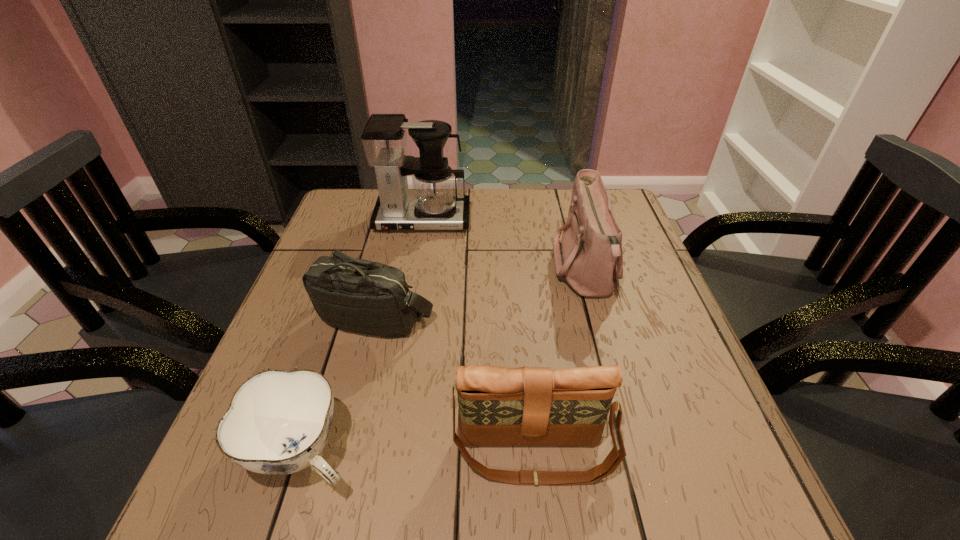
At what (x,y) coordinates should I click in order to perform the action: click on chinaware situated at the near edge. Please return your answer as a coordinate pair (x, y). Looking at the image, I should click on (278, 422).

Find the location of a particular element. The width and height of the screenshot is (960, 540). coffee maker that is at the left edge is located at coordinates (434, 205).

This screenshot has width=960, height=540. Find the location of `shoulder bag at the left edge`. shoulder bag at the left edge is located at coordinates 357,295.

Identify the location of chinaware situated at the left edge. The height and width of the screenshot is (540, 960). [x=278, y=422].

Where is `object at the right edge`? This screenshot has width=960, height=540. object at the right edge is located at coordinates (589, 258).

This screenshot has width=960, height=540. I want to click on object present at the far left corner, so click(x=434, y=205).

Locate an element on the screen. object present at the near left corner is located at coordinates (278, 422).

You are a GUI agent. You are given a task and a screenshot of the screen. Output one action in this format:
    pyautogui.click(x=<x>, y=<y>)
    Task: Click on the vacant space at the far edge of the desktop
    
    Given the screenshot: What is the action you would take?
    pyautogui.click(x=488, y=202)

In the image, there is a desktop. At what (x,y) coordinates should I click in order to perform the action: click on vacant space at the near edge. Please return your answer as a coordinate pair (x, y). The height and width of the screenshot is (540, 960). Looking at the image, I should click on (456, 482).

In the image, there is a desktop. Find the location of `vacant space at the left edge`. vacant space at the left edge is located at coordinates (354, 237).